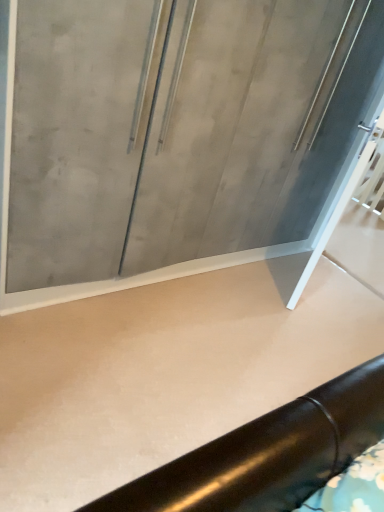
Question: Considering the positions of matte gray glass door at center and smooth concrete at center in the image, is matte gray glass door at center taller or shorter than smooth concrete at center?

Choices:
 (A) short
 (B) tall

Answer: (B)

Question: Would you say matte gray glass door at center is to the left or to the right of smooth concrete at center in the picture?

Choices:
 (A) left
 (B) right

Answer: (A)

Question: Is matte gray glass door at center wider or thinner than smooth concrete at center?

Choices:
 (A) thin
 (B) wide

Answer: (A)

Question: Considering their positions, is smooth concrete at center located in front of or behind matte gray glass door at center?

Choices:
 (A) front
 (B) behind

Answer: (A)

Question: Is point (117, 302) positioned closer to the camera than point (150, 72)?

Choices:
 (A) closer
 (B) farther

Answer: (B)

Question: Considering the positions of smooth concrete at center and matte gray glass door at center in the image, is smooth concrete at center taller or shorter than matte gray glass door at center?

Choices:
 (A) tall
 (B) short

Answer: (B)

Question: In terms of size, does smooth concrete at center appear bigger or smaller than matte gray glass door at center?

Choices:
 (A) big
 (B) small

Answer: (B)